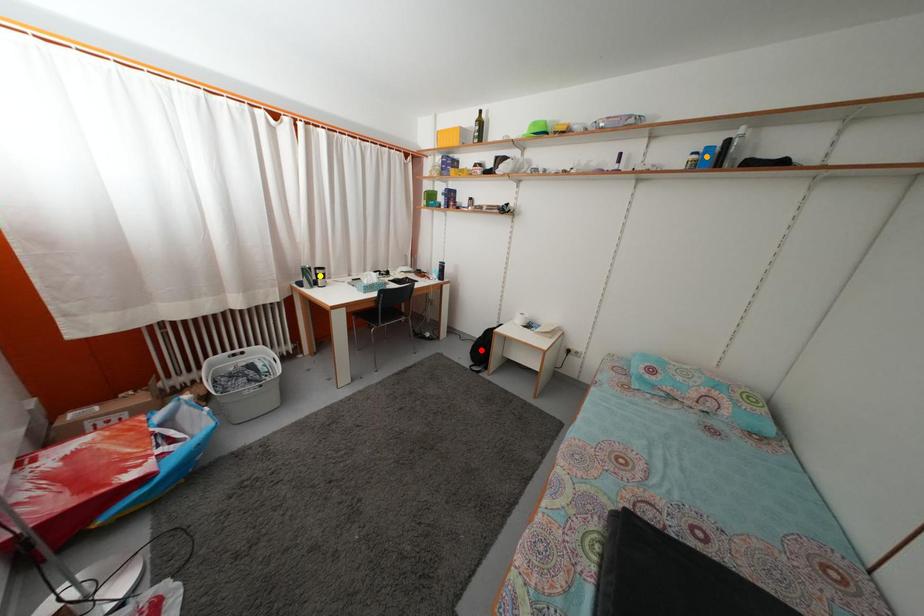
Order these from nearest to farthest:
- yellow point
- orange point
- red point

red point
yellow point
orange point